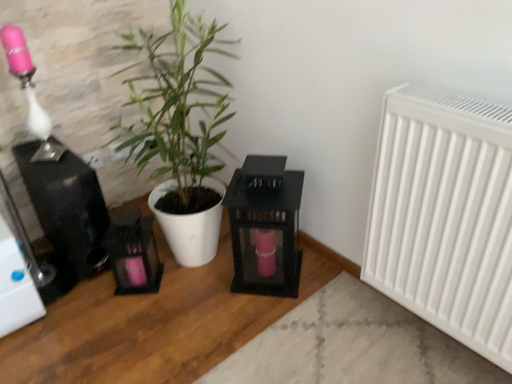
In order to face matte pink glass at upper left, should I rotate leftwards or rightwards?

Turn left approximately 28.231 degrees to face it.

Where is `white matte radiator at right`? The width and height of the screenshot is (512, 384). white matte radiator at right is located at coordinates (445, 214).

Measure the distance between point (270, 206) and camera.

The distance of point (270, 206) from camera is 4.25 feet.

Where is `matte pink glass at upper left`? matte pink glass at upper left is located at coordinates (25, 78).

In the image, is white matte radiator at right positioned in front of or behind matte pink glass at upper left?

In the image, white matte radiator at right appears in front of matte pink glass at upper left.

Who is smaller, white matte radiator at right or matte pink glass at upper left?

matte pink glass at upper left.

I want to click on radiator that is in front of the matte pink glass at upper left, so click(445, 214).

Is white matte radiator at right positioned beyond the bounds of matte pink glass at upper left?

Yes, white matte radiator at right is not within matte pink glass at upper left.

Is matte pink glass at upper left at the left side of white matte radiator at right?

Indeed, matte pink glass at upper left is positioned on the left side of white matte radiator at right.

From the picture: Is matte pink glass at upper left looking in the opposite direction of white matte radiator at right?

matte pink glass at upper left is not turned away from white matte radiator at right.

From the image's perspective, relative to white matte radiator at right, is matte pink glass at upper left above or below?

matte pink glass at upper left is above white matte radiator at right.

Looking at this image, from a real-world perspective, who is located lower, white matte radiator at right or white matte plant pot at center?

white matte radiator at right is physically lower.

Considering the sizes of objects white matte radiator at right and white matte plant pot at center in the image provided, who is bigger, white matte radiator at right or white matte plant pot at center?

white matte plant pot at center is bigger.

From the image's perspective, which object appears higher, white matte radiator at right or white matte plant pot at center?

white matte plant pot at center appears higher in the image.

Between white matte radiator at right and white matte plant pot at center, which one has less height?

With less height is white matte radiator at right.

Is matte pink glass at upper left at the left side of white matte plant pot at center?

Indeed, matte pink glass at upper left is positioned on the left side of white matte plant pot at center.

Is matte pink glass at upper left wider than white matte plant pot at center?

No, matte pink glass at upper left is not wider than white matte plant pot at center.

Is matte pink glass at upper left in front of or behind white matte plant pot at center in the image?

In the image, matte pink glass at upper left appears behind white matte plant pot at center.

Which object is thinner, white matte plant pot at center or black glass lantern at center?

black glass lantern at center.

From the image's perspective, would you say white matte plant pot at center is shown under black glass lantern at center?

Incorrect, from the image's perspective, white matte plant pot at center is higher than black glass lantern at center.

Can you tell me how much white matte plant pot at center and black glass lantern at center differ in facing direction?

white matte plant pot at center and black glass lantern at center are facing 48.2 degrees away from each other.

Are white matte plant pot at center and black glass lantern at center far apart?

No, white matte plant pot at center is in close proximity to black glass lantern at center.

Is white matte plant pot at center bigger or smaller than white matte radiator at right?

In the image, white matte plant pot at center appears to be larger than white matte radiator at right.

Considering the positions of point (193, 208) and point (395, 159), is point (193, 208) closer or farther from the camera than point (395, 159)?

Point (193, 208).

Where is `radiator lying in front of the white matte plant pot at center`? The width and height of the screenshot is (512, 384). radiator lying in front of the white matte plant pot at center is located at coordinates (445, 214).

Is white matte plant pot at center facing away from white matte radiator at right?

No.

Considering the positions of objects black glass lantern at center and white matte plant pot at center in the image provided, who is more to the right, black glass lantern at center or white matte plant pot at center?

black glass lantern at center is more to the right.

Considering the sizes of objects black glass lantern at center and white matte plant pot at center in the image provided, who is shorter, black glass lantern at center or white matte plant pot at center?

black glass lantern at center is shorter.

Is black glass lantern at center positioned behind white matte plant pot at center?

Yes, it is.

Considering the positions of points (296, 244) and (224, 165), is point (296, 244) closer to camera compared to point (224, 165)?

Yes, it is.

Where is `radiator located on the right of matte pink glass at upper left`? Image resolution: width=512 pixels, height=384 pixels. radiator located on the right of matte pink glass at upper left is located at coordinates [x=445, y=214].

Where is `radiator that appears below the matte pink glass at upper left (from a real-world perspective)`? Image resolution: width=512 pixels, height=384 pixels. radiator that appears below the matte pink glass at upper left (from a real-world perspective) is located at coordinates (445, 214).

Estimate the real-world distances between objects in this image. Which object is further from black glass lantern at center, white matte radiator at right or white matte plant pot at center?

white matte radiator at right lies further to black glass lantern at center than the other object.

Based on their spatial positions, is black glass lantern at center or white matte plant pot at center closer to white matte radiator at right?

black glass lantern at center is closer to white matte radiator at right.

Looking at this image, looking at the image, which one is located closer to black glass lantern at center, white matte radiator at right or matte pink glass at upper left?

white matte radiator at right is closer to black glass lantern at center.

From the image, which object appears to be nearer to white matte plant pot at center, black glass lantern at center or white matte radiator at right?

Based on the image, black glass lantern at center appears to be nearer to white matte plant pot at center.

Which object lies nearer to the anchor point white matte radiator at right, white matte plant pot at center or black glass lantern at center?

Among the two, black glass lantern at center is located nearer to white matte radiator at right.

Considering their positions, is white matte radiator at right positioned further to white matte plant pot at center than matte pink glass at upper left?

white matte radiator at right is further to white matte plant pot at center.

Estimate the real-world distances between objects in this image. Which object is closer to white matte radiator at right, matte pink glass at upper left or white matte plant pot at center?

The object closer to white matte radiator at right is white matte plant pot at center.

Looking at the image, which one is located closer to white matte radiator at right, matte pink glass at upper left or black glass lantern at center?

Among the two, black glass lantern at center is located nearer to white matte radiator at right.

Locate an element on the screen. houseplant located between matte pink glass at upper left and white matte radiator at right in the left-right direction is located at coordinates (180, 132).

What are the coordinates of `table situated between matte pink glass at upper left and white matte radiator at right from left to right` in the screenshot? It's located at (265, 226).

Where is `houseplant located between matte pink glass at upper left and black glass lantern at center in the left-right direction`? The image size is (512, 384). houseplant located between matte pink glass at upper left and black glass lantern at center in the left-right direction is located at coordinates (180, 132).

The height and width of the screenshot is (384, 512). Identify the location of table between white matte plant pot at center and white matte radiator at right from left to right. (265, 226).